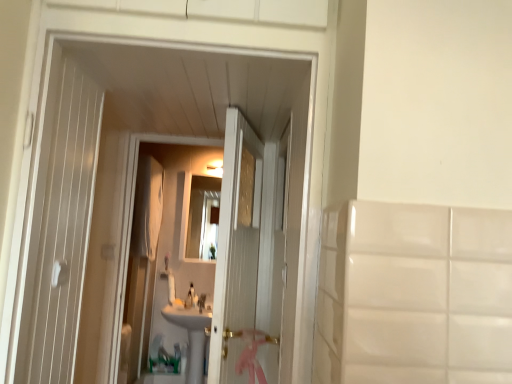
Question: Is white glossy sink at center bigger than white glossy mirror at center?

Choices:
 (A) no
 (B) yes

Answer: (B)

Question: From the image's perspective, is white glossy sink at center located beneath white glossy mirror at center?

Choices:
 (A) yes
 (B) no

Answer: (A)

Question: Does white glossy sink at center have a lesser height compared to white glossy mirror at center?

Choices:
 (A) no
 (B) yes

Answer: (B)

Question: Is white glossy sink at center looking in the opposite direction of white glossy mirror at center?

Choices:
 (A) no
 (B) yes

Answer: (A)

Question: Is the depth of white glossy sink at center less than that of white glossy mirror at center?

Choices:
 (A) yes
 (B) no

Answer: (A)

Question: Considering the positions of white glossy mirror at center and white glossy sink at center in the image, is white glossy mirror at center wider or thinner than white glossy sink at center?

Choices:
 (A) thin
 (B) wide

Answer: (A)

Question: Would you say white glossy mirror at center is to the left or to the right of white glossy sink at center in the picture?

Choices:
 (A) left
 (B) right

Answer: (B)

Question: Considering their positions, is white glossy mirror at center located in front of or behind white glossy sink at center?

Choices:
 (A) behind
 (B) front

Answer: (A)

Question: From a real-world perspective, is white glossy mirror at center positioned above or below white glossy sink at center?

Choices:
 (A) above
 (B) below

Answer: (A)

Question: In terms of width, does white glossy mirror at center look wider or thinner when compared to white glossy soap at center?

Choices:
 (A) thin
 (B) wide

Answer: (A)

Question: From their relative heights in the image, would you say white glossy mirror at center is taller or shorter than white glossy soap at center?

Choices:
 (A) short
 (B) tall

Answer: (B)

Question: Is point (208, 231) closer or farther from the camera than point (181, 304)?

Choices:
 (A) farther
 (B) closer

Answer: (A)

Question: From the image's perspective, is white glossy mirror at center positioned above or below white glossy soap at center?

Choices:
 (A) below
 (B) above

Answer: (B)

Question: Considering their positions, is white wooden door at center located in front of or behind white glossy soap at center?

Choices:
 (A) front
 (B) behind

Answer: (A)

Question: Is white wooden door at center taller or shorter than white glossy soap at center?

Choices:
 (A) short
 (B) tall

Answer: (B)